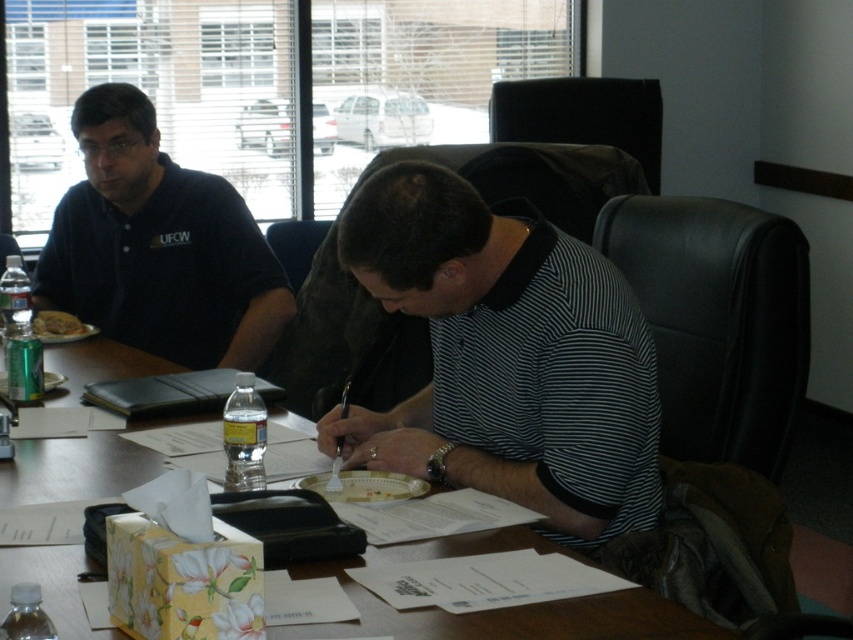
You are organizing a meeting in this conference room and need to seat two people. Given the dimensions of the matte black polo shirt at left and the wooden table at center, can both individuals comfortably sit side by side on the table?

The matte black polo shirt at left is wider than the wooden table at center, so the table may not have enough space to accommodate both individuals sitting side by side comfortably.

In the conference room scene, there is a point labeled at coordinates (505,358). Which object from the scene does this point correspond to?

The point at coordinates (505,358) corresponds to the black striped shirt at center.

You are organizing a meeting in this conference room and need to determine if the matte black polo shirt at left can be placed on top of the black leather folder at center without covering it completely. Based on their sizes, what do you think?

The matte black polo shirt at left is bigger than the black leather folder at center, so placing it on top would likely cover the folder completely.